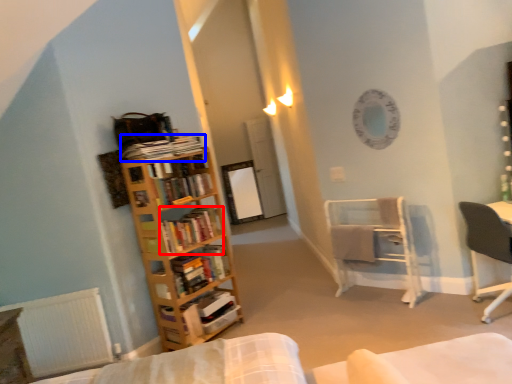
Question: Among these objects, which one is nearest to the camera, book (highlighted by a red box) or book (highlighted by a blue box)?

Choices:
 (A) book
 (B) book

Answer: (B)